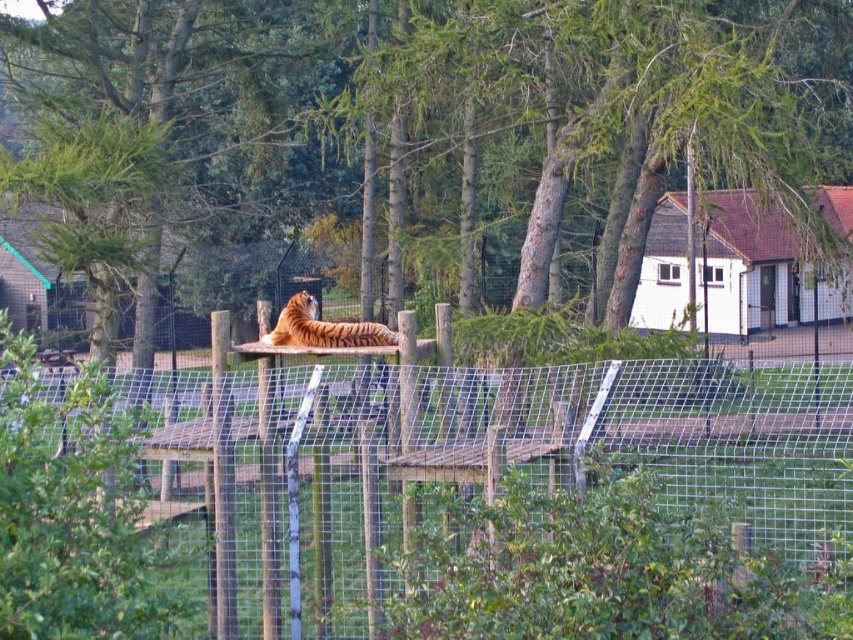
Between metallic wire mesh at center and orange striped tiger at center, which one appears on the left side from the viewer's perspective?

From the viewer's perspective, orange striped tiger at center appears more on the left side.

In the scene shown: Who is more distant from viewer, (483,536) or (271,332)?

The point (271,332) is behind.

Where is `metallic wire mesh at center`? This screenshot has height=640, width=853. metallic wire mesh at center is located at coordinates (422, 500).

Is green leafy tree at center smaller than orange striped tiger at center?

Incorrect, green leafy tree at center is not smaller in size than orange striped tiger at center.

Can you confirm if green leafy tree at center is bigger than orange striped tiger at center?

Yes, green leafy tree at center is bigger than orange striped tiger at center.

The height and width of the screenshot is (640, 853). Identify the location of green leafy tree at center. (486, 93).

Is point (842, 472) closer to viewer compared to point (718, 24)?

Yes, it is.

Can you confirm if metallic wire mesh at center is positioned above green leafy tree at center?

Actually, metallic wire mesh at center is below green leafy tree at center.

Describe the element at coordinates (422, 500) in the screenshot. Image resolution: width=853 pixels, height=640 pixels. I see `metallic wire mesh at center` at that location.

You are a GUI agent. You are given a task and a screenshot of the screen. Output one action in this format:
    pyautogui.click(x=<x>, y=<y>)
    Task: Click on the metallic wire mesh at center
    
    Given the screenshot: What is the action you would take?
    pyautogui.click(x=422, y=500)